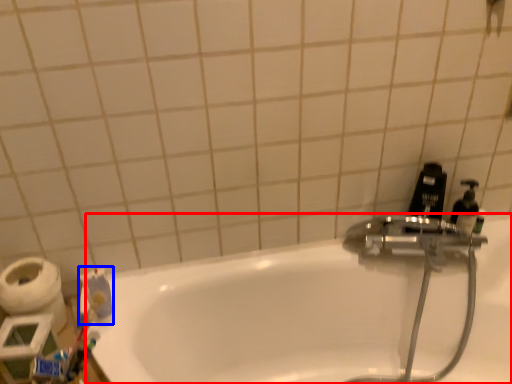
Question: Which point is closer to the camera, bathtub (highlighted by a red box) or toothpaste (highlighted by a blue box)?

Choices:
 (A) bathtub
 (B) toothpaste

Answer: (A)